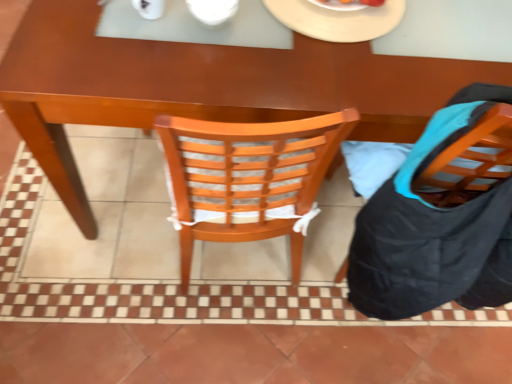
Find the location of a particular element. vacant space to the right of white glossy bowl at upper center is located at coordinates (289, 41).